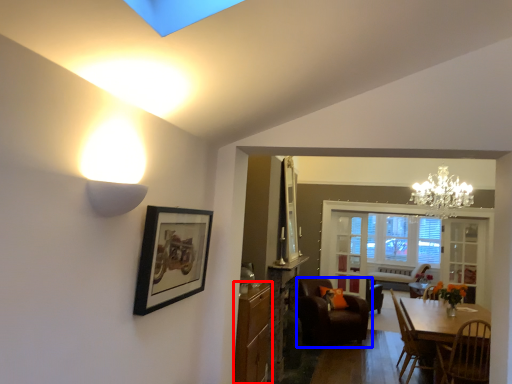
Question: Which object is further to the camera taking this photo, cabinetry (highlighted by a red box) or chair (highlighted by a blue box)?

Choices:
 (A) cabinetry
 (B) chair

Answer: (B)